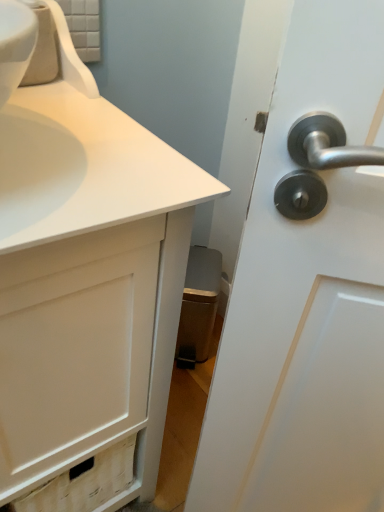
This screenshot has width=384, height=512. Describe the element at coordinates (71, 55) in the screenshot. I see `white glossy faucet at upper left` at that location.

Where is `white glossy faucet at upper left`? This screenshot has height=512, width=384. white glossy faucet at upper left is located at coordinates (71, 55).

What is the approximate height of white glossy faucet at upper left?

white glossy faucet at upper left is 6.61 inches tall.

In the scene shown: Measure the distance between white glossy faucet at upper left and camera.

27.93 inches.

In order to face white glossy faucet at upper left, should I rotate leftwards or rightwards?

It's best to rotate left around 23.743 degrees.

This screenshot has height=512, width=384. Describe the element at coordinates (86, 275) in the screenshot. I see `white matte cabinet at lower left` at that location.

This screenshot has height=512, width=384. What are the coordinates of `white matte cabinet at lower left` in the screenshot? It's located at (86, 275).

Image resolution: width=384 pixels, height=512 pixels. I want to click on white glossy faucet at upper left, so click(71, 55).

Is white matte cabinet at lower left at the right side of white glossy faucet at upper left?

Correct, you'll find white matte cabinet at lower left to the right of white glossy faucet at upper left.

Between white matte cabinet at lower left and white glossy faucet at upper left, which one is positioned in front?

Positioned in front is white matte cabinet at lower left.

Does point (45, 223) appear closer or farther from the camera than point (45, 3)?

Point (45, 223) is positioned closer to the camera compared to point (45, 3).

From the image's perspective, is white matte cabinet at lower left positioned above or below white glossy faucet at upper left?

white matte cabinet at lower left is below white glossy faucet at upper left.

From a real-world perspective, relative to white glossy faucet at upper left, is white matte cabinet at lower left vertically above or below?

From a real-world perspective, white matte cabinet at lower left is physically below white glossy faucet at upper left.

Is white matte cabinet at lower left wider or thinner than white glossy faucet at upper left?

Considering their sizes, white matte cabinet at lower left looks broader than white glossy faucet at upper left.

Considering the sizes of white matte cabinet at lower left and white glossy faucet at upper left in the image, is white matte cabinet at lower left taller or shorter than white glossy faucet at upper left?

In the image, white matte cabinet at lower left appears to be taller than white glossy faucet at upper left.

Can you confirm if white matte cabinet at lower left is bigger than white glossy faucet at upper left?

Yes, white matte cabinet at lower left is bigger than white glossy faucet at upper left.

Would you say white matte cabinet at lower left is inside or outside white glossy faucet at upper left?

white matte cabinet at lower left exists outside the volume of white glossy faucet at upper left.

Are white matte cabinet at lower left and white glossy faucet at upper left far apart?

white matte cabinet at lower left is actually quite close to white glossy faucet at upper left.

Is white matte cabinet at lower left oriented towards white glossy faucet at upper left?

No.

In the image, there is a white matte cabinet at lower left. Identify the location of faucet above it (from the image's perspective). Image resolution: width=384 pixels, height=512 pixels. (71, 55).

Based on their positions, is white glossy faucet at upper left located to the left or right of white matte cabinet at lower left?

From the image, it's evident that white glossy faucet at upper left is to the left of white matte cabinet at lower left.

In the image, is white glossy faucet at upper left positioned in front of or behind white matte cabinet at lower left?

Visually, white glossy faucet at upper left is located behind white matte cabinet at lower left.

Does point (64, 32) appear closer or farther from the camera than point (23, 142)?

Point (64, 32) is farther from the camera than point (23, 142).

From the image's perspective, is white glossy faucet at upper left located above white matte cabinet at lower left?

Yes, from the image's perspective, white glossy faucet at upper left is above white matte cabinet at lower left.

From a real-world perspective, which is physically below, white glossy faucet at upper left or white matte cabinet at lower left?

white matte cabinet at lower left, from a real-world perspective.

In the scene shown: Between white glossy faucet at upper left and white matte cabinet at lower left, which one has larger width?

Wider between the two is white matte cabinet at lower left.

Does white glossy faucet at upper left have a lesser height compared to white matte cabinet at lower left?

Indeed, white glossy faucet at upper left has a lesser height compared to white matte cabinet at lower left.

Looking at the image, does white glossy faucet at upper left seem bigger or smaller compared to white matte cabinet at lower left?

In the image, white glossy faucet at upper left appears to be smaller than white matte cabinet at lower left.

Consider the image. Is white glossy faucet at upper left inside or outside of white matte cabinet at lower left?

white glossy faucet at upper left is enclosed within white matte cabinet at lower left.

Is white glossy faucet at upper left next to white matte cabinet at lower left and touching it?

There is a gap between white glossy faucet at upper left and white matte cabinet at lower left.

Is white glossy faucet at upper left oriented away from white matte cabinet at lower left?

Result: Yes, white glossy faucet at upper left is facing away from white matte cabinet at lower left.

In the image, there is a white glossy faucet at upper left. Identify the location of bathroom cabinet below it (from the image's perspective). (86, 275).

Where is `faucet above the white matte cabinet at lower left (from a real-world perspective)`? The height and width of the screenshot is (512, 384). faucet above the white matte cabinet at lower left (from a real-world perspective) is located at coordinates [71, 55].

Find the location of a particular element. The image size is (384, 512). faucet lying behind the white matte cabinet at lower left is located at coordinates (71, 55).